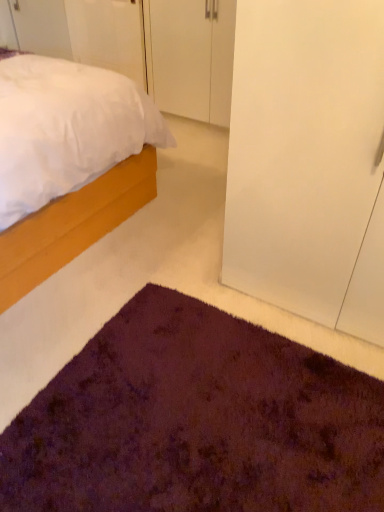
Question: Is purple shaggy rug at lower center completely or partially inside transparent glass door at right?

Choices:
 (A) yes
 (B) no

Answer: (B)

Question: Is transparent glass door at right aimed at purple shaggy rug at lower center?

Choices:
 (A) no
 (B) yes

Answer: (B)

Question: Is transparent glass door at right far away from purple shaggy rug at lower center?

Choices:
 (A) no
 (B) yes

Answer: (A)

Question: Is transparent glass door at right positioned beyond the bounds of purple shaggy rug at lower center?

Choices:
 (A) no
 (B) yes

Answer: (B)

Question: Considering the relative sizes of transparent glass door at right and purple shaggy rug at lower center in the image provided, is transparent glass door at right smaller than purple shaggy rug at lower center?

Choices:
 (A) yes
 (B) no

Answer: (B)

Question: Considering their positions, is white matte door at upper left, which is the 2th door in right-to-left order, located in front of or behind transparent glass door at right?

Choices:
 (A) behind
 (B) front

Answer: (A)

Question: Would you say white matte door at upper left, which is the 2th door in right-to-left order, is to the left or to the right of transparent glass door at right in the picture?

Choices:
 (A) right
 (B) left

Answer: (B)

Question: Looking at their shapes, would you say white matte door at upper left, the 1th door from the left, is wider or thinner than transparent glass door at right?

Choices:
 (A) thin
 (B) wide

Answer: (A)

Question: Is white matte door at upper left, the 1th door from the left, bigger or smaller than transparent glass door at right?

Choices:
 (A) small
 (B) big

Answer: (A)

Question: Looking at their shapes, would you say white matte cabinet at upper center, the 1th door viewed from the right, is wider or thinner than transparent glass door at right?

Choices:
 (A) wide
 (B) thin

Answer: (B)

Question: From a real-world perspective, is white matte cabinet at upper center, marked as the 2th door in a left-to-right arrangement, physically located above or below transparent glass door at right?

Choices:
 (A) above
 (B) below

Answer: (B)

Question: Based on their sizes in the image, would you say white matte cabinet at upper center, the 1th door viewed from the right, is bigger or smaller than transparent glass door at right?

Choices:
 (A) big
 (B) small

Answer: (B)

Question: From the image's perspective, is white matte cabinet at upper center, marked as the 2th door in a left-to-right arrangement, above or below transparent glass door at right?

Choices:
 (A) above
 (B) below

Answer: (A)

Question: Is transparent glass door at right wider or thinner than purple shaggy rug at lower center?

Choices:
 (A) thin
 (B) wide

Answer: (A)

Question: Looking at the image, does transparent glass door at right seem bigger or smaller compared to purple shaggy rug at lower center?

Choices:
 (A) big
 (B) small

Answer: (A)